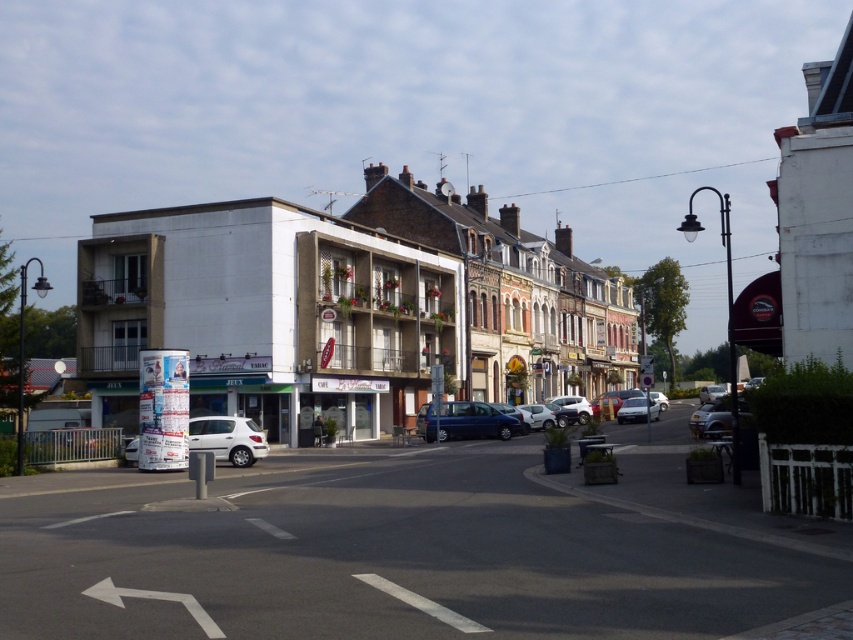
You are standing on the street and see two points marked in the image. Which point, point (560,260) or point (645,410), is closer to you?

Point (560,260) is closer to you because it is further to the viewer than point (645,410).